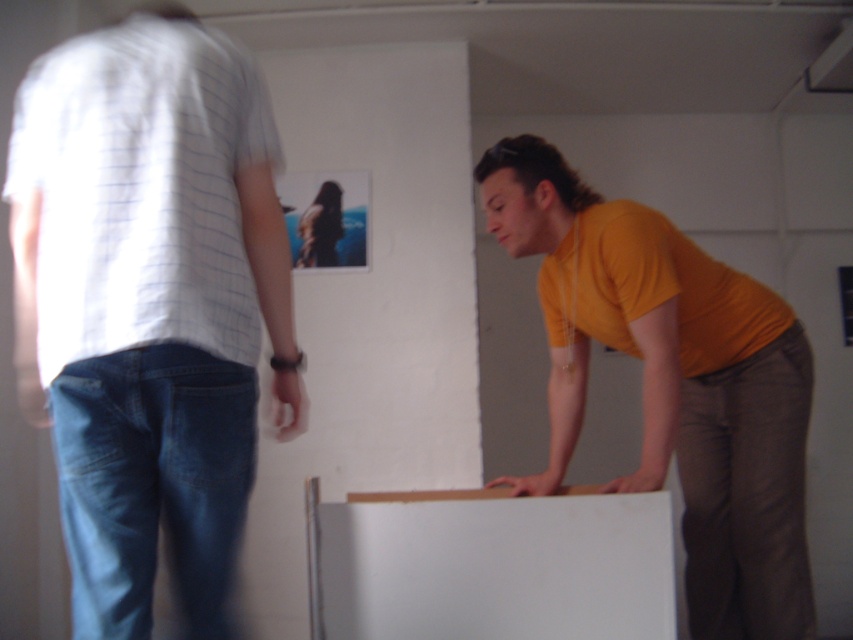
Question: Is matte white shirt at left positioned at the back of smooth brown hair at upper center?

Choices:
 (A) no
 (B) yes

Answer: (A)

Question: Which point appears closest to the camera in this image?

Choices:
 (A) (310, 234)
 (B) (41, 289)
 (C) (751, 332)

Answer: (B)

Question: Can you confirm if matte yellow shirt at right is positioned to the left of smooth brown hair at upper center?

Choices:
 (A) yes
 (B) no

Answer: (B)

Question: Which point is farther from the camera taking this photo?

Choices:
 (A) (28, 113)
 (B) (300, 248)
 (C) (704, 477)

Answer: (B)

Question: Which point is closer to the camera?

Choices:
 (A) (552, 378)
 (B) (329, 230)
 (C) (247, 145)

Answer: (C)

Question: Can you confirm if matte yellow shirt at right is smaller than smooth brown hair at upper center?

Choices:
 (A) yes
 (B) no

Answer: (B)